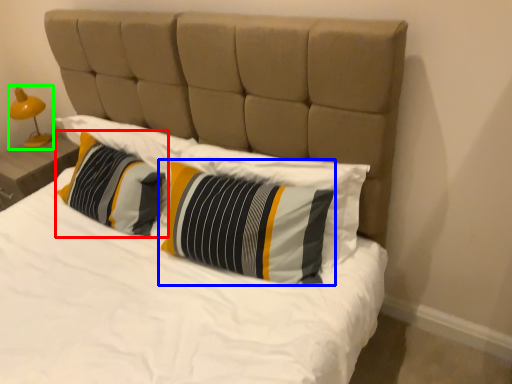
Question: Estimate the real-world distances between objects in this image. Which object is farther from pillow (highlighted by a red box), pillow (highlighted by a blue box) or bedside lamp (highlighted by a green box)?

Choices:
 (A) pillow
 (B) bedside lamp

Answer: (B)